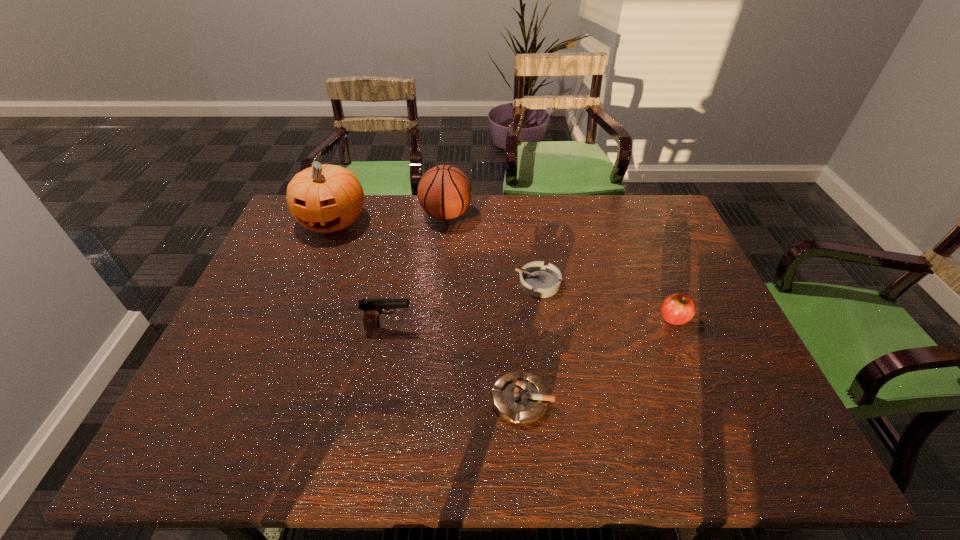
The height and width of the screenshot is (540, 960). Identify the location of vacant space located at the barrel of the pistol. (444, 326).

Identify the location of vacant region located on the front of the rightmost object. The width and height of the screenshot is (960, 540). (706, 394).

Where is `vacant space located 0.390m on the back of the farther ashtray`? The width and height of the screenshot is (960, 540). vacant space located 0.390m on the back of the farther ashtray is located at coordinates (526, 195).

The height and width of the screenshot is (540, 960). I want to click on free space located on the back of the nearest object, so click(x=517, y=332).

The image size is (960, 540). In order to click on pumpkin that is at the far edge in this screenshot , I will do `click(325, 198)`.

This screenshot has width=960, height=540. I want to click on basketball at the far edge, so click(x=444, y=192).

Find the location of a particular element. object that is at the near edge is located at coordinates (520, 398).

Find the location of a particular element. Image resolution: width=960 pixels, height=540 pixels. object at the left edge is located at coordinates (325, 198).

Where is `object that is positioned at the right edge`? The height and width of the screenshot is (540, 960). object that is positioned at the right edge is located at coordinates click(x=677, y=309).

You are a GUI agent. You are given a task and a screenshot of the screen. Output one action in this format:
    pyautogui.click(x=<x>, y=<y>)
    Task: Click on the object located at the far left corner
    
    Given the screenshot: What is the action you would take?
    pyautogui.click(x=325, y=198)